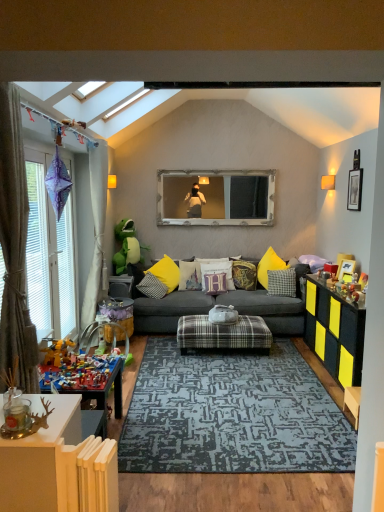
Question: From a real-world perspective, is plush yellow pillow at center, which is counted as the fourth pillow, starting from the right, physically above dark gray fabric couch at center?

Choices:
 (A) no
 (B) yes

Answer: (B)

Question: Considering the relative sizes of plush yellow pillow at center, which is counted as the fourth pillow, starting from the right, and dark gray fabric couch at center in the image provided, is plush yellow pillow at center, which is counted as the fourth pillow, starting from the right, smaller than dark gray fabric couch at center?

Choices:
 (A) yes
 (B) no

Answer: (A)

Question: Can you confirm if plush yellow pillow at center, the 3th pillow from the left, is wider than dark gray fabric couch at center?

Choices:
 (A) yes
 (B) no

Answer: (B)

Question: From the image's perspective, is plush yellow pillow at center, the 3th pillow from the left, above dark gray fabric couch at center?

Choices:
 (A) yes
 (B) no

Answer: (A)

Question: Is plush yellow pillow at center, which is counted as the fourth pillow, starting from the right, not close to dark gray fabric couch at center?

Choices:
 (A) no
 (B) yes

Answer: (A)

Question: In terms of height, does green plush toy at left, the first toy positioned from the back, look taller or shorter compared to white fabric pillow at center, which is the fourth pillow from left to right?

Choices:
 (A) tall
 (B) short

Answer: (A)

Question: Is green plush toy at left, which is the 1th toy from top to bottom, inside or outside of white fabric pillow at center, which is the fourth pillow from left to right?

Choices:
 (A) inside
 (B) outside

Answer: (B)

Question: From the image's perspective, is green plush toy at left, marked as the 2th toy in a front-to-back arrangement, positioned above or below white fabric pillow at center, which is the fourth pillow from left to right?

Choices:
 (A) below
 (B) above

Answer: (B)

Question: In the image, is green plush toy at left, the first toy positioned from the back, on the left side or the right side of white fabric pillow at center, which is the fourth pillow from left to right?

Choices:
 (A) left
 (B) right

Answer: (A)

Question: From a real-world perspective, is wooden picture frame at upper right, marked as the first picture frame in a right-to-left arrangement, above or below white wooden frame at center?

Choices:
 (A) above
 (B) below

Answer: (A)

Question: Considering their positions, is wooden picture frame at upper right, marked as the first picture frame in a right-to-left arrangement, located in front of or behind white wooden frame at center?

Choices:
 (A) behind
 (B) front

Answer: (B)

Question: From their relative heights in the image, would you say wooden picture frame at upper right, which appears as the 2th picture frame when viewed from the left, is taller or shorter than white wooden frame at center?

Choices:
 (A) tall
 (B) short

Answer: (B)

Question: Is wooden picture frame at upper right, acting as the first picture frame starting from the top, wider or thinner than white wooden frame at center?

Choices:
 (A) wide
 (B) thin

Answer: (B)

Question: Looking at their shapes, would you say yellow plastic toy at lower left, which appears as the second toy when viewed from the top, is wider or thinner than black textured dresser at right?

Choices:
 (A) wide
 (B) thin

Answer: (B)

Question: From a real-world perspective, relative to black textured dresser at right, is yellow plastic toy at lower left, placed as the 1th toy when sorted from bottom to top, vertically above or below?

Choices:
 (A) below
 (B) above

Answer: (B)